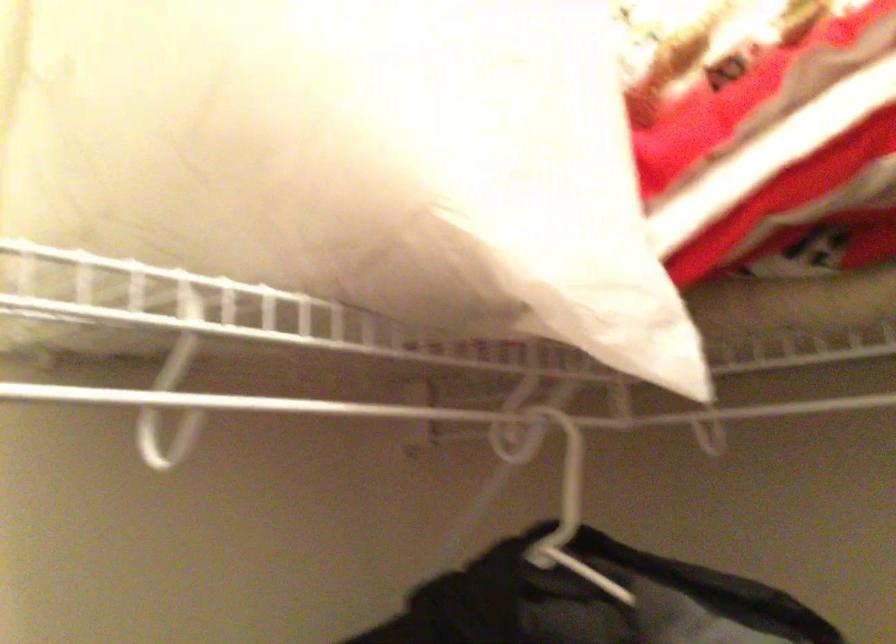
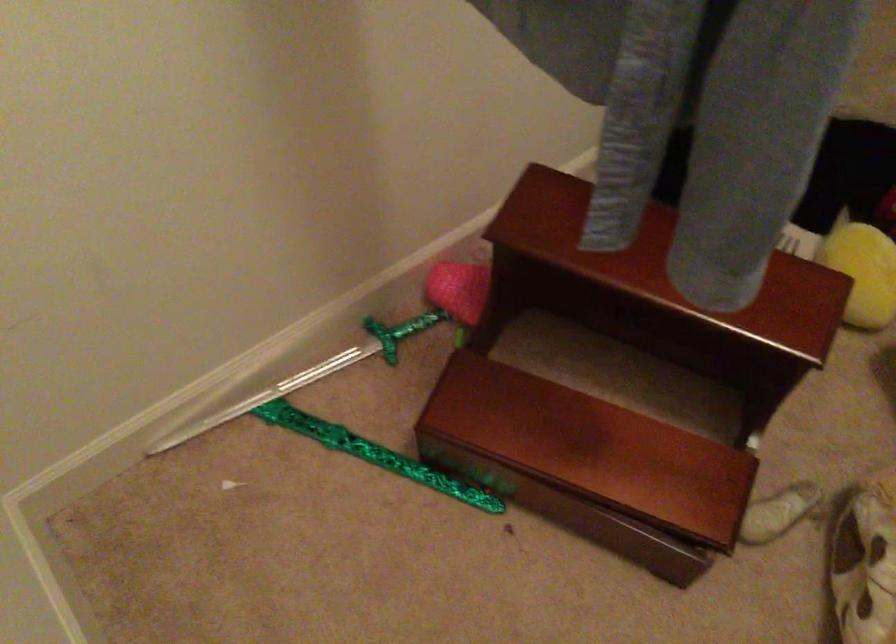
Based on the photo, first-person continuous shooting, in which direction is the camera rotating?

The camera's rotation is toward left-down.